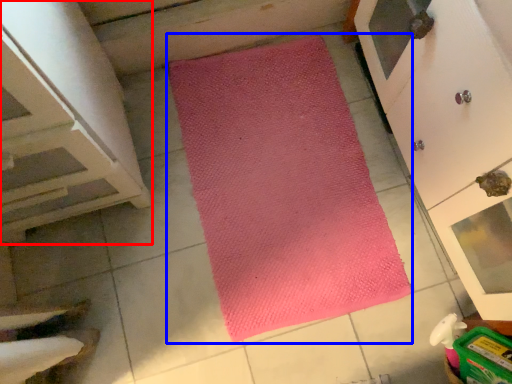
Question: Among these objects, which one is farthest to the camera, cabinetry (highlighted by a red box) or mat (highlighted by a blue box)?

Choices:
 (A) cabinetry
 (B) mat

Answer: (B)